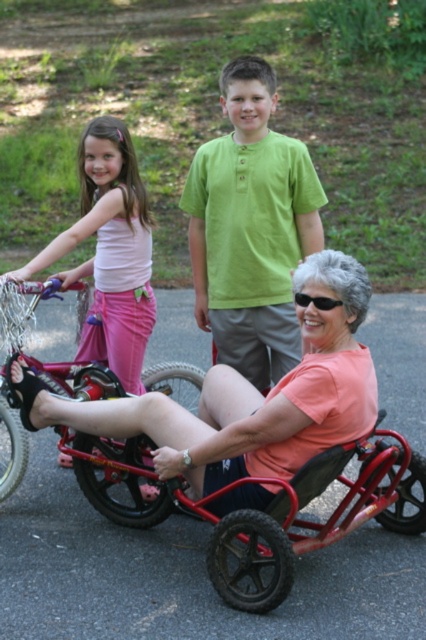
Is green cotton shirt at center above matte pink shorts at left?

Yes.

Locate an element on the screen. The height and width of the screenshot is (640, 426). green cotton shirt at center is located at coordinates (250, 227).

How much distance is there between matte pink shorts at left and metallic red bicycle at center?

They are 14.34 inches apart.

Between point (20, 275) and point (65, 442), which one is positioned in front?

Point (20, 275) is in front.

The height and width of the screenshot is (640, 426). Describe the element at coordinates (109, 252) in the screenshot. I see `matte pink shorts at left` at that location.

Where is `matte pink shorts at left`? The width and height of the screenshot is (426, 640). matte pink shorts at left is located at coordinates (109, 252).

Who is positioned more to the right, pink fabric wheelchair at center or green cotton shirt at center?

green cotton shirt at center is more to the right.

Which is more to the left, pink fabric wheelchair at center or green cotton shirt at center?

pink fabric wheelchair at center is more to the left.

You are a GUI agent. You are given a task and a screenshot of the screen. Output one action in this format:
    pyautogui.click(x=<x>, y=<y>)
    Task: Click on the pink fabric wheelchair at center
    
    Given the screenshot: What is the action you would take?
    pyautogui.click(x=247, y=396)

Image resolution: width=426 pixels, height=640 pixels. What are the coordinates of `pink fabric wheelchair at center` in the screenshot? It's located at (247, 396).